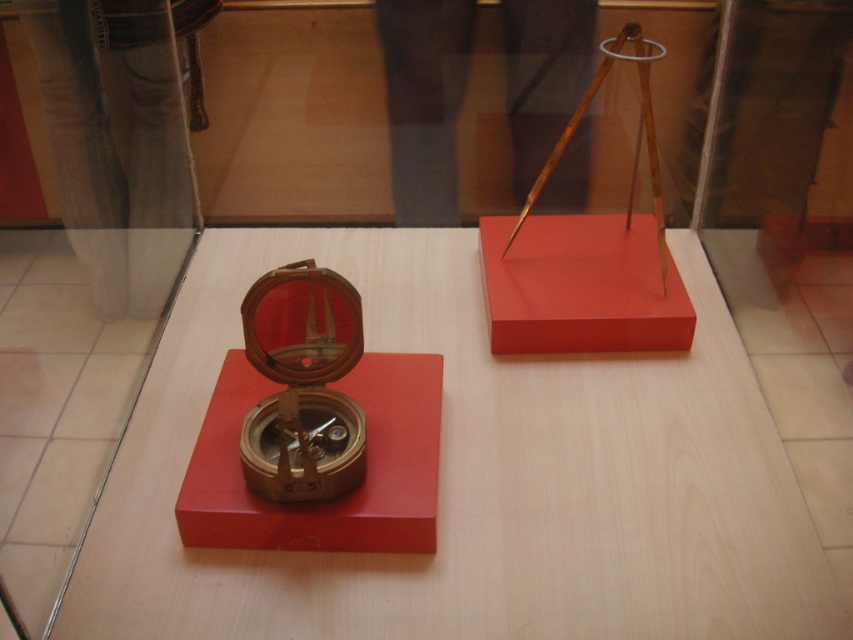
Question: Which object is positioned farthest from the matte wooden table at center?

Choices:
 (A) brass compass at center
 (B) wooden compass at center

Answer: (B)

Question: Is brass compass at center closer to camera compared to matte red box at center?

Choices:
 (A) no
 (B) yes

Answer: (B)

Question: Which object is farther from the camera taking this photo?

Choices:
 (A) matte red box at center
 (B) wooden compass at center

Answer: (A)

Question: Which object appears farthest from the camera in this image?

Choices:
 (A) wooden compass at center
 (B) brass compass at center

Answer: (B)

Question: Can you confirm if brass compass at center is positioned to the left of matte red box at center?

Choices:
 (A) yes
 (B) no

Answer: (A)

Question: Is matte wooden table at center closer to the viewer compared to brass compass at center?

Choices:
 (A) yes
 (B) no

Answer: (A)